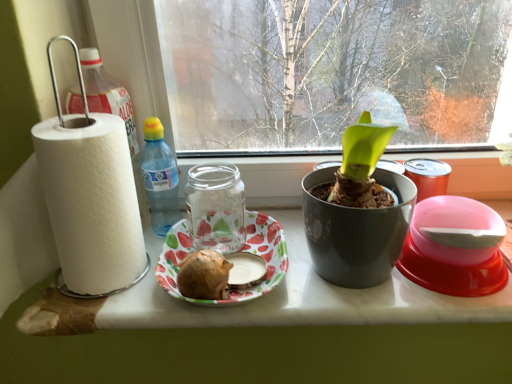
Question: Is transparent glass jar at center in front of or behind brown matte potato at center in the image?

Choices:
 (A) front
 (B) behind

Answer: (B)

Question: From the image's perspective, relative to brown matte potato at center, is transparent glass jar at center above or below?

Choices:
 (A) above
 (B) below

Answer: (A)

Question: Which object is positioned farthest from the pink plastic bowl at right?

Choices:
 (A) strawberry-patterned paper plate at center
 (B) transparent glass jar at center
 (C) brown matte potato at center
 (D) white paper towel at left
 (E) translucent plastic bottle at center

Answer: (E)

Question: Estimate the real-world distances between objects in this image. Which object is closer to the brown matte potato at center?

Choices:
 (A) pink plastic bowl at right
 (B) translucent plastic bottle at center
 (C) white paper at left
 (D) white paper towel at left
 (E) transparent glass jar at center

Answer: (C)